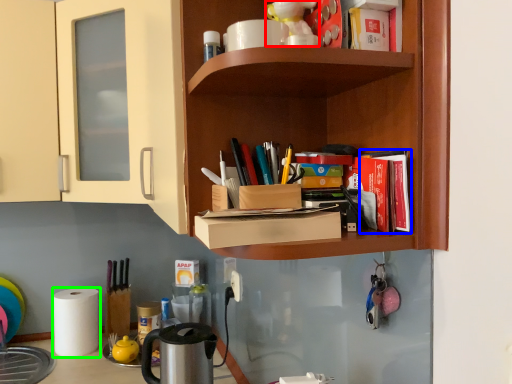
Question: Based on their relative distances, which object is farther from toy (highlighted by a red box)? Choose from book (highlighted by a blue box) and paper towel (highlighted by a green box).

Choices:
 (A) book
 (B) paper towel

Answer: (B)